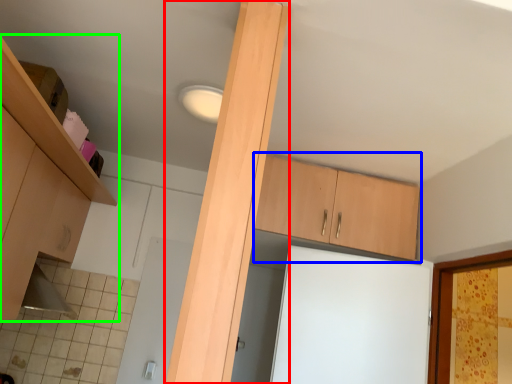
Question: Which object is the closest to the beam (highlighted by a red box)? Choose among these: cabinetry (highlighted by a blue box) or cabinetry (highlighted by a green box).

Choices:
 (A) cabinetry
 (B) cabinetry

Answer: (B)